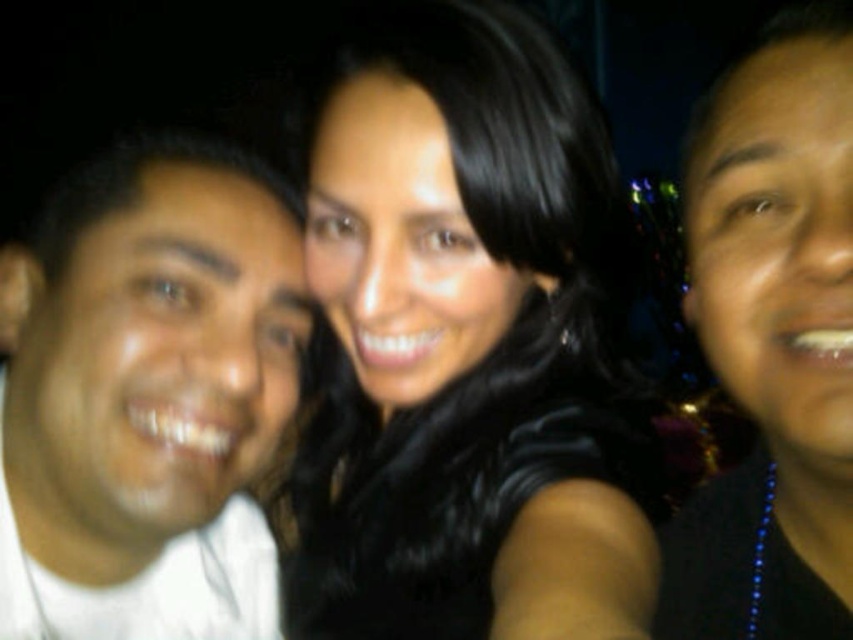
Does black leather hair at center have a greater height compared to black matte necklace at center?

Correct, black leather hair at center is much taller as black matte necklace at center.

Can you confirm if black leather hair at center is shorter than black matte necklace at center?

Incorrect, black leather hair at center's height does not fall short of black matte necklace at center's.

Does point (352, 556) lie in front of point (775, 582)?

No.

Locate an element on the screen. black leather hair at center is located at coordinates (466, 344).

Can you confirm if black leather hair at center is smaller than white matte shirt at left?

No.

Is point (515, 259) positioned after point (51, 568)?

Yes.

Between point (584, 445) and point (241, 552), which one is positioned in front?

Point (584, 445)

The image size is (853, 640). Find the location of `black leather hair at center`. black leather hair at center is located at coordinates (466, 344).

From the picture: Who is shorter, white matte shirt at left or black matte necklace at center?

black matte necklace at center

Can you confirm if white matte shirt at left is shorter than black matte necklace at center?

Incorrect, white matte shirt at left's height does not fall short of black matte necklace at center's.

Between point (129, 324) and point (798, 637), which one is positioned in front?

Point (798, 637)

This screenshot has width=853, height=640. Identify the location of white matte shirt at left. (148, 396).